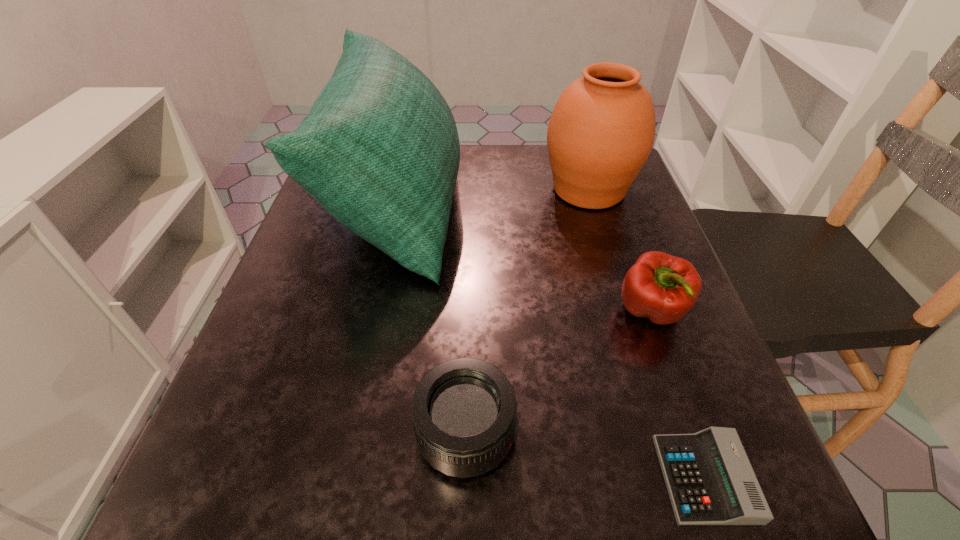
Find the location of a particular element. The image size is (960, 540). cushion is located at coordinates (379, 150).

The height and width of the screenshot is (540, 960). I want to click on urn, so click(601, 131).

This screenshot has width=960, height=540. What are the coordinates of `the third tallest object` in the screenshot? It's located at (663, 288).

Locate an element on the screen. The image size is (960, 540). telephoto lens is located at coordinates (464, 410).

Locate an element on the screen. The image size is (960, 540). the shortest object is located at coordinates (710, 481).

Where is `vacant point located 0.270m on the front-facing side of the cushion`? The height and width of the screenshot is (540, 960). vacant point located 0.270m on the front-facing side of the cushion is located at coordinates (581, 204).

I want to click on vacant space located on the front of the urn, so click(x=631, y=327).

At what (x,y) coordinates should I click in order to perform the action: click on free space located 0.330m on the left of the third tallest object. Please return your answer as a coordinate pair (x, y). The image size is (960, 540). Looking at the image, I should click on (428, 312).

This screenshot has height=540, width=960. I want to click on free point located 0.300m on the side of the second shortest object with brand markings and control switches, so click(x=732, y=434).

Where is `vacant space located 0.120m on the left of the calculator`? vacant space located 0.120m on the left of the calculator is located at coordinates (571, 478).